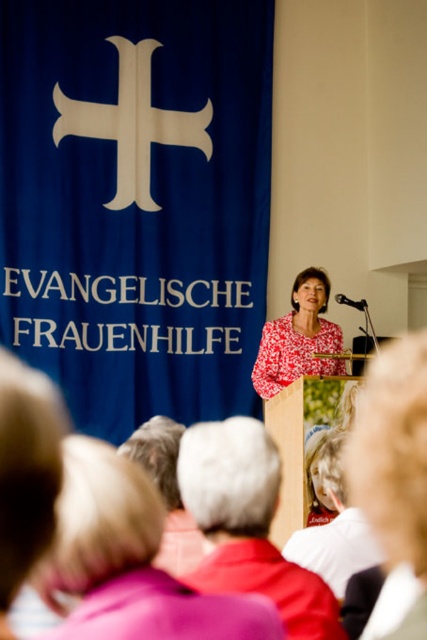
You are an event organizer who needs to ensure that the pink fabric at lower center and the floral fabric blouse at center are visible to the audience. Based on their positions, which object is more likely to be seen clearly by the audience?

The pink fabric at lower center is closer to the viewer than the floral fabric blouse at center, so the pink fabric at lower center is more likely to be seen clearly by the audience.

You are organizing a photo shoot and need to ensure that the blonde hair at center and the black plastic microphone at center are in focus simultaneously. Given that your camera has a depth of field range of 7 meters, will both objects be in focus?

The distance between the blonde hair at center and the black plastic microphone at center is 7.76 meters. Since the depth of field range is only 7 meters, the two objects are too far apart to be in focus at the same time.

You are a photographer at the event and want to capture a closeup shot of the speaker. Which object between the blonde hair at center and the black plastic microphone at center would appear wider in the photo?

The black plastic microphone at center is wider than the blonde hair at center, so it would appear wider in the photo.